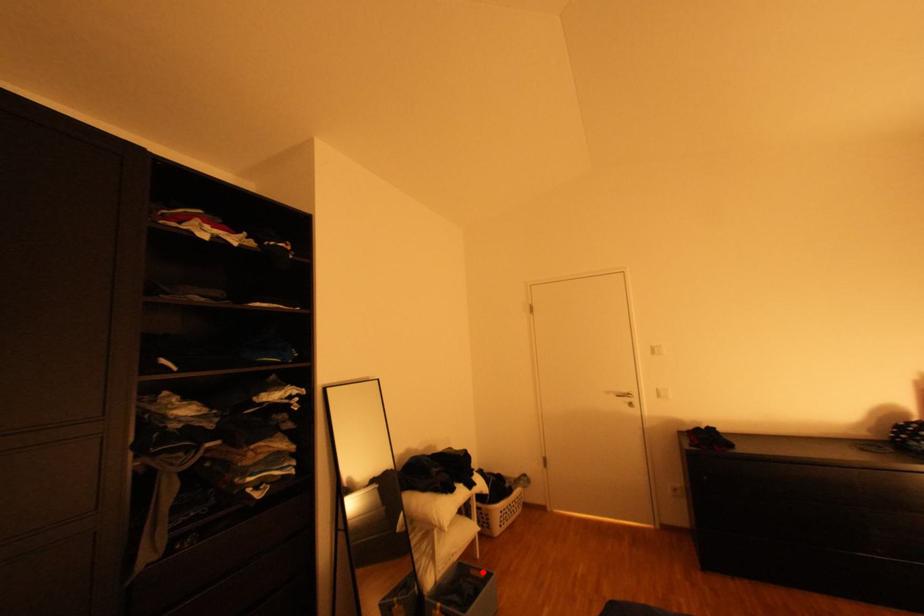
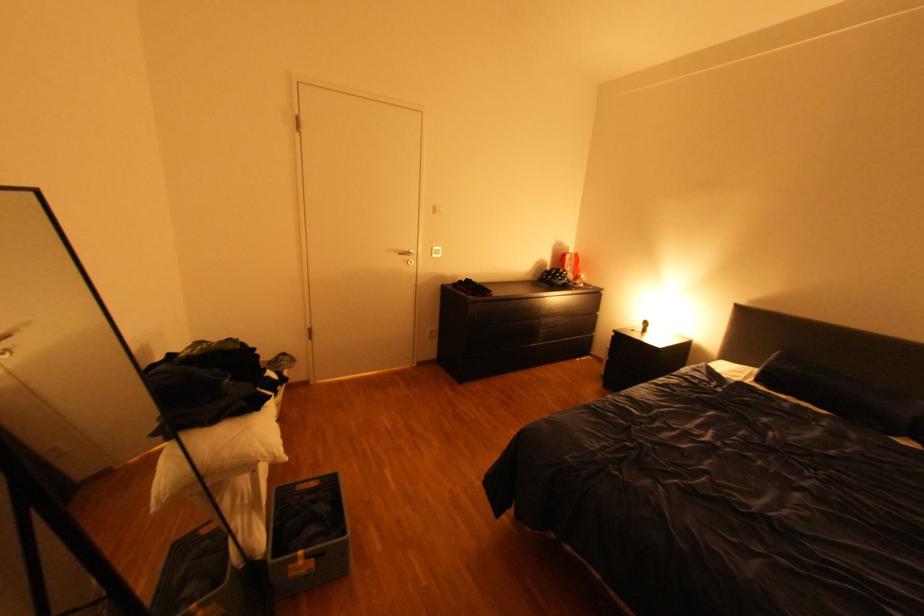
Locate, in the second image, the point that corresponds to the highlighted location in the first image.

(310, 488)